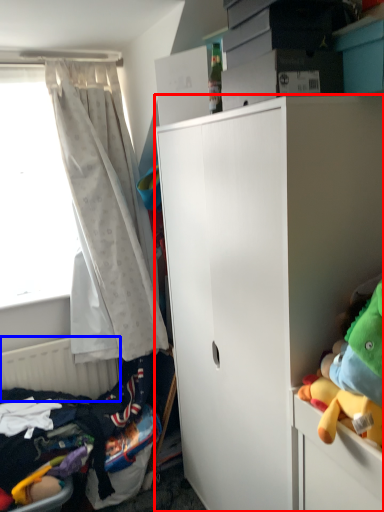
Question: Which of the following is the closest to the observer, cabinetry (highlighted by a red box) or radiator (highlighted by a blue box)?

Choices:
 (A) cabinetry
 (B) radiator

Answer: (A)